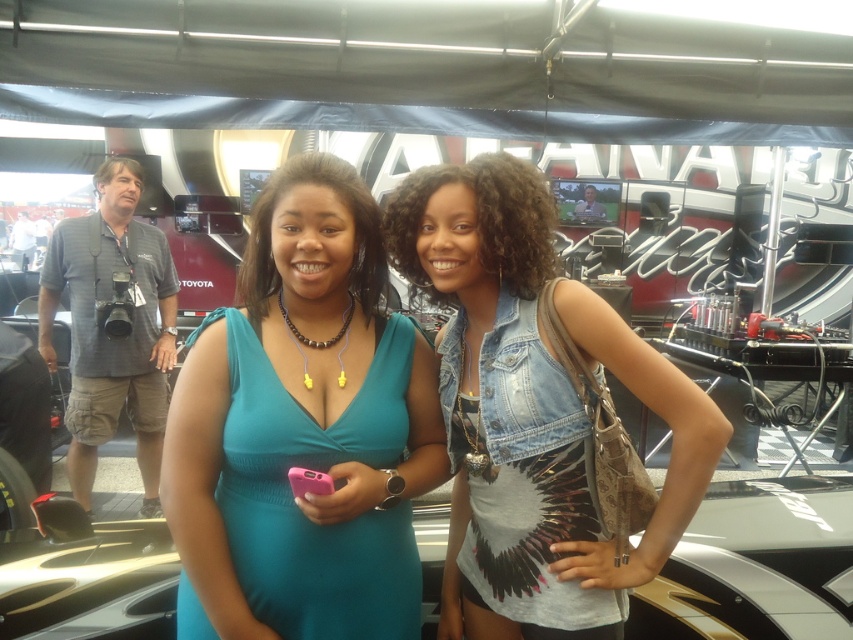
Consider the image. Is teal fabric dress at center taller than denim vest at center?

No, teal fabric dress at center is not taller than denim vest at center.

Describe the element at coordinates (303, 429) in the screenshot. This screenshot has height=640, width=853. I see `teal fabric dress at center` at that location.

You are a GUI agent. You are given a task and a screenshot of the screen. Output one action in this format:
    pyautogui.click(x=<x>, y=<y>)
    Task: Click on the teal fabric dress at center
    
    Given the screenshot: What is the action you would take?
    pyautogui.click(x=303, y=429)